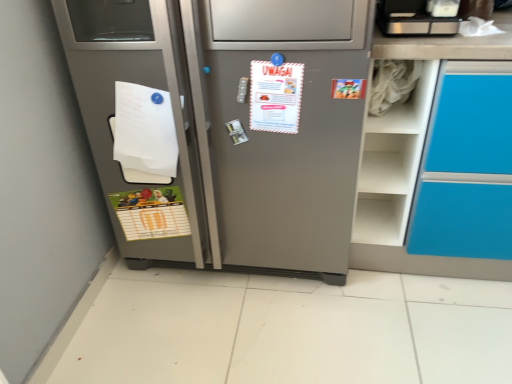
Question: Considering the relative sizes of green matte postcard at lower left, arranged as the 2th postcard when viewed from the top, and brushed metal toaster at upper right in the image provided, is green matte postcard at lower left, arranged as the 2th postcard when viewed from the top, wider than brushed metal toaster at upper right?

Choices:
 (A) yes
 (B) no

Answer: (B)

Question: Is green matte postcard at lower left, which ranks as the first postcard in bottom-to-top order, positioned beyond the bounds of brushed metal toaster at upper right?

Choices:
 (A) no
 (B) yes

Answer: (B)

Question: Considering the relative positions of green matte postcard at lower left, which is the 2th postcard from right to left, and brushed metal toaster at upper right in the image provided, is green matte postcard at lower left, which is the 2th postcard from right to left, to the left of brushed metal toaster at upper right from the viewer's perspective?

Choices:
 (A) no
 (B) yes

Answer: (B)

Question: From a real-world perspective, is green matte postcard at lower left, arranged as the first postcard when viewed from the back, under brushed metal toaster at upper right?

Choices:
 (A) no
 (B) yes

Answer: (B)

Question: Is green matte postcard at lower left, arranged as the first postcard when viewed from the back, beside brushed metal toaster at upper right?

Choices:
 (A) yes
 (B) no

Answer: (B)

Question: From a real-world perspective, is white matte shelf at upper right on top of satin silver refrigerator at center?

Choices:
 (A) yes
 (B) no

Answer: (A)

Question: Is white matte shelf at upper right facing away from satin silver refrigerator at center?

Choices:
 (A) yes
 (B) no

Answer: (B)

Question: Is white matte shelf at upper right smaller than satin silver refrigerator at center?

Choices:
 (A) no
 (B) yes

Answer: (B)

Question: From the image's perspective, is white matte shelf at upper right below satin silver refrigerator at center?

Choices:
 (A) yes
 (B) no

Answer: (B)

Question: Is white matte shelf at upper right thinner than satin silver refrigerator at center?

Choices:
 (A) yes
 (B) no

Answer: (A)

Question: Can you confirm if white matte shelf at upper right is shorter than satin silver refrigerator at center?

Choices:
 (A) yes
 (B) no

Answer: (A)

Question: Is the depth of brushed metal toaster at upper right less than that of green matte postcard at lower left, which is the 2th postcard from right to left?

Choices:
 (A) no
 (B) yes

Answer: (B)